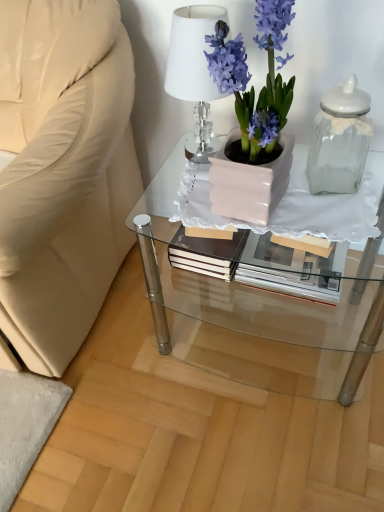
Question: Is matte white glass table at center oriented towards clear glass jar at right?

Choices:
 (A) no
 (B) yes

Answer: (A)

Question: Is matte white glass table at center not near clear glass jar at right?

Choices:
 (A) no
 (B) yes

Answer: (A)

Question: Does matte white glass table at center have a lesser width compared to clear glass jar at right?

Choices:
 (A) yes
 (B) no

Answer: (B)

Question: From the image's perspective, is matte white glass table at center above clear glass jar at right?

Choices:
 (A) no
 (B) yes

Answer: (A)

Question: Can you confirm if matte white glass table at center is positioned to the left of clear glass jar at right?

Choices:
 (A) no
 (B) yes

Answer: (B)

Question: From the image's perspective, is matte white glass table at center located above or below clear glass jar at right?

Choices:
 (A) above
 (B) below

Answer: (B)

Question: Is matte white glass table at center inside the boundaries of clear glass jar at right, or outside?

Choices:
 (A) inside
 (B) outside

Answer: (B)

Question: Considering the positions of matte white glass table at center and clear glass jar at right in the image, is matte white glass table at center bigger or smaller than clear glass jar at right?

Choices:
 (A) small
 (B) big

Answer: (B)

Question: Visually, is matte white glass table at center positioned to the left or to the right of clear glass jar at right?

Choices:
 (A) left
 (B) right

Answer: (A)

Question: Considering the positions of white crystal lamp at upper center and matte pink pot at center in the image, is white crystal lamp at upper center taller or shorter than matte pink pot at center?

Choices:
 (A) tall
 (B) short

Answer: (B)

Question: Considering the positions of white crystal lamp at upper center and matte pink pot at center in the image, is white crystal lamp at upper center wider or thinner than matte pink pot at center?

Choices:
 (A) thin
 (B) wide

Answer: (A)

Question: In the image, is white crystal lamp at upper center positioned in front of or behind matte pink pot at center?

Choices:
 (A) behind
 (B) front

Answer: (A)

Question: Is white crystal lamp at upper center to the left or to the right of matte pink pot at center in the image?

Choices:
 (A) right
 (B) left

Answer: (B)

Question: Based on their positions, is clear glass jar at right located to the left or right of matte pink pot at center?

Choices:
 (A) left
 (B) right

Answer: (B)

Question: Is clear glass jar at right bigger or smaller than matte pink pot at center?

Choices:
 (A) small
 (B) big

Answer: (A)